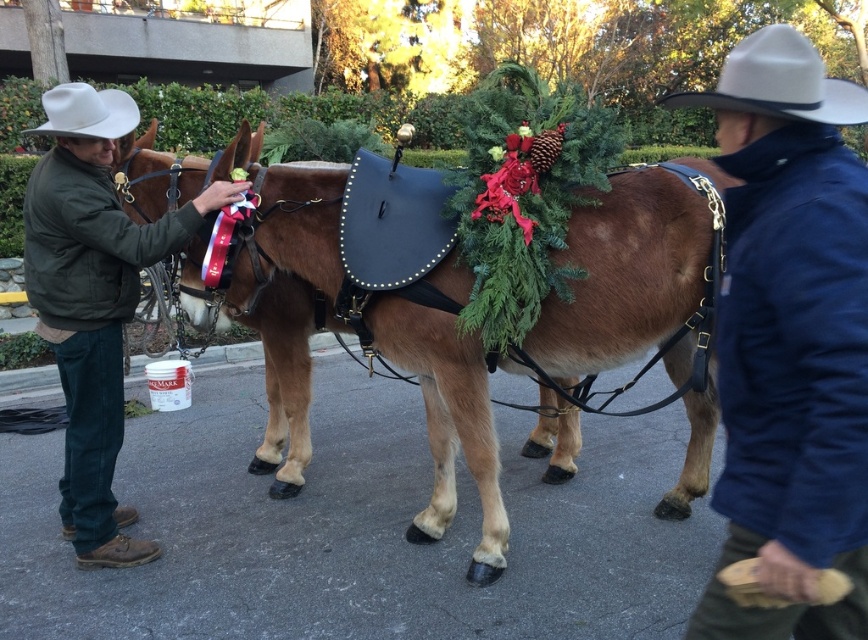
Question: Is blue woolen jacket at right further to the viewer compared to white felt cowboy hat at upper left?

Choices:
 (A) no
 (B) yes

Answer: (A)

Question: Which point is farther to the camera?

Choices:
 (A) white felt cowboy hat at upper left
 (B) brown leather saddle at center
 (C) green cotton jacket at left

Answer: (A)

Question: Can you confirm if green cotton jacket at left is positioned below white felt cowboy hat at upper left?

Choices:
 (A) no
 (B) yes

Answer: (B)

Question: Which point is farther to the camera?

Choices:
 (A) green cotton jacket at left
 (B) blue woolen jacket at right
 (C) white felt cowboy hat at upper right

Answer: (A)

Question: Can you confirm if blue woolen jacket at right is positioned to the left of white felt cowboy hat at upper left?

Choices:
 (A) yes
 (B) no

Answer: (B)

Question: Which point is closer to the camera?

Choices:
 (A) blue woolen jacket at right
 (B) brown leather saddle at center

Answer: (A)